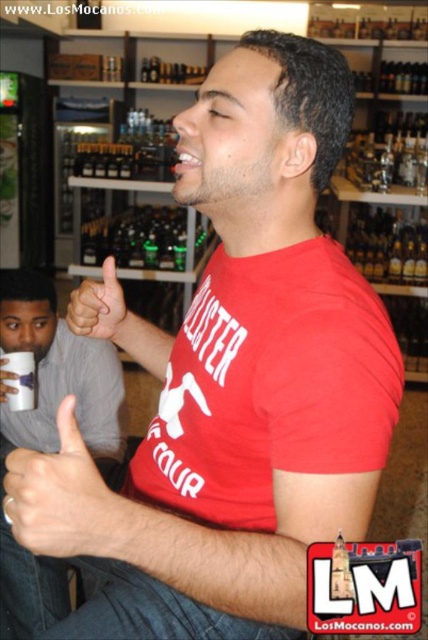
Question: Estimate the real-world distances between objects in this image. Which object is closer to the matte red thumb at center?

Choices:
 (A) white matte cup at lower left
 (B) skinny metallic ring at upper center
 (C) gray fabric shirt at left

Answer: (B)

Question: Is gray fabric shirt at left smaller than matte red thumb at center?

Choices:
 (A) no
 (B) yes

Answer: (A)

Question: Is matte red thumb at center smaller than white matte cup at lower left?

Choices:
 (A) no
 (B) yes

Answer: (A)

Question: Does skinny metallic ring at upper center appear on the right side of matte red thumb at center?

Choices:
 (A) yes
 (B) no

Answer: (A)

Question: Which point is closer to the camera?

Choices:
 (A) skinny metallic ring at upper center
 (B) gray fabric shirt at left

Answer: (A)

Question: Among these objects, which one is farthest from the camera?

Choices:
 (A) matte red thumb at center
 (B) white matte cup at lower left

Answer: (B)